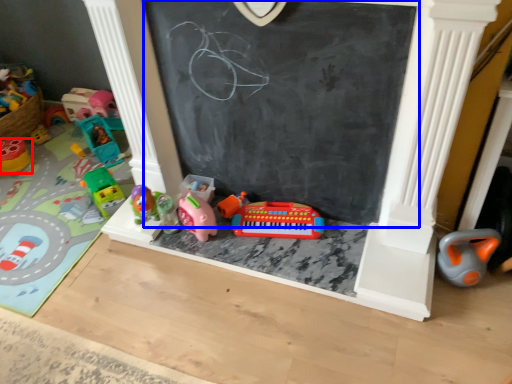
Question: Which point is further to the camera, toy (highlighted by a red box) or bulletin board (highlighted by a blue box)?

Choices:
 (A) toy
 (B) bulletin board

Answer: (A)